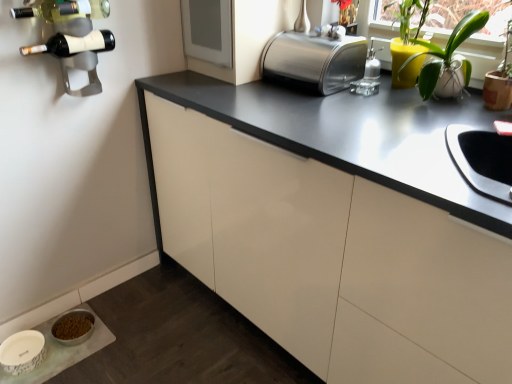
Locate an element on the screen. empty space that is ontop of matte black wine bottle at upper left, positioned as the 2th wine bottle in top-to-bottom order (from a real-world perspective) is located at coordinates [73, 31].